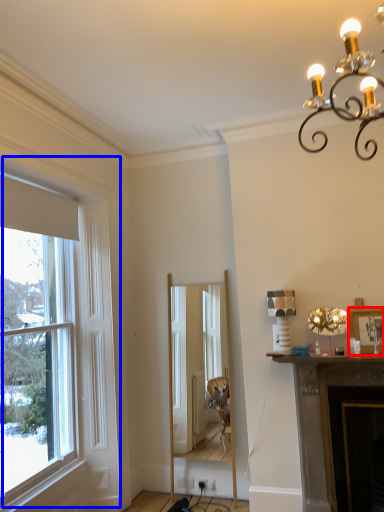
Question: Which of the following is the closest to the observer, picture frame (highlighted by a red box) or window (highlighted by a blue box)?

Choices:
 (A) picture frame
 (B) window

Answer: (B)